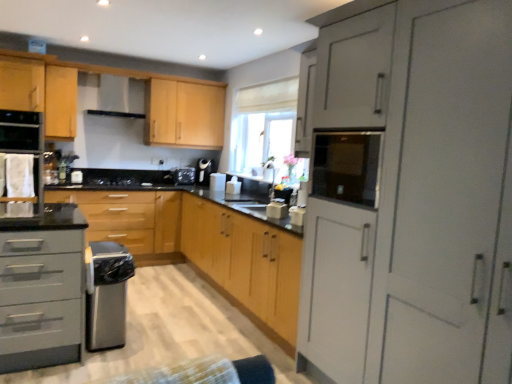
Question: Is white fabric oven at left completely or partially inside white glossy toaster at center?

Choices:
 (A) no
 (B) yes

Answer: (A)

Question: From the image's perspective, is white glossy toaster at center located beneath white fabric oven at left?

Choices:
 (A) yes
 (B) no

Answer: (A)

Question: Are white glossy toaster at center and white fabric oven at left beside each other?

Choices:
 (A) yes
 (B) no

Answer: (B)

Question: Does white glossy toaster at center have a lesser width compared to white fabric oven at left?

Choices:
 (A) yes
 (B) no

Answer: (A)

Question: Considering the relative positions of white glossy toaster at center and white fabric oven at left in the image provided, is white glossy toaster at center to the left of white fabric oven at left from the viewer's perspective?

Choices:
 (A) no
 (B) yes

Answer: (A)

Question: In the image, is black glass microwave at upper right positioned in front of or behind matte gray drawer at left, the third cabinetry in the back-to-front sequence?

Choices:
 (A) front
 (B) behind

Answer: (A)

Question: Would you say black glass microwave at upper right is inside or outside matte gray drawer at left, the 3th cabinetry in the front-to-back sequence?

Choices:
 (A) inside
 (B) outside

Answer: (B)

Question: From the image's perspective, is black glass microwave at upper right above or below matte gray drawer at left, the 3th cabinetry in the front-to-back sequence?

Choices:
 (A) above
 (B) below

Answer: (A)

Question: In terms of size, does black glass microwave at upper right appear bigger or smaller than matte gray drawer at left, the third cabinetry in the back-to-front sequence?

Choices:
 (A) small
 (B) big

Answer: (A)

Question: Is matte gray cabinet at right, which is the fifth cabinetry from back to front, situated inside satin black stove at center, the 2th appliance positioned from the back, or outside?

Choices:
 (A) inside
 (B) outside

Answer: (B)

Question: Looking at the image, does matte gray cabinet at right, marked as the 1th cabinetry in a front-to-back arrangement, seem bigger or smaller compared to satin black stove at center, the 5th appliance viewed from the right?

Choices:
 (A) small
 (B) big

Answer: (B)

Question: From a real-world perspective, relative to satin black stove at center, the 5th appliance viewed from the right, is matte gray cabinet at right, which is the fifth cabinetry from back to front, vertically above or below?

Choices:
 (A) above
 (B) below

Answer: (A)

Question: Considering the relative positions of matte gray cabinet at right, which is the fifth cabinetry from back to front, and satin black stove at center, the 5th appliance viewed from the right, in the image provided, is matte gray cabinet at right, which is the fifth cabinetry from back to front, to the left or to the right of satin black stove at center, the 5th appliance viewed from the right,?

Choices:
 (A) right
 (B) left

Answer: (A)

Question: Is black matte gas stove at center to the left or to the right of white glossy toaster at center, marked as the 5th appliance in a left-to-right arrangement, in the image?

Choices:
 (A) right
 (B) left

Answer: (B)

Question: Which is correct: black matte gas stove at center is inside white glossy toaster at center, which ranks as the second appliance in right-to-left order, or outside of it?

Choices:
 (A) outside
 (B) inside

Answer: (A)